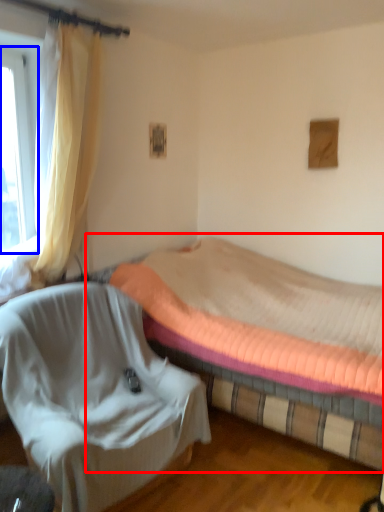
Question: Which point is closer to the camera, bed (highlighted by a red box) or window (highlighted by a blue box)?

Choices:
 (A) bed
 (B) window

Answer: (A)